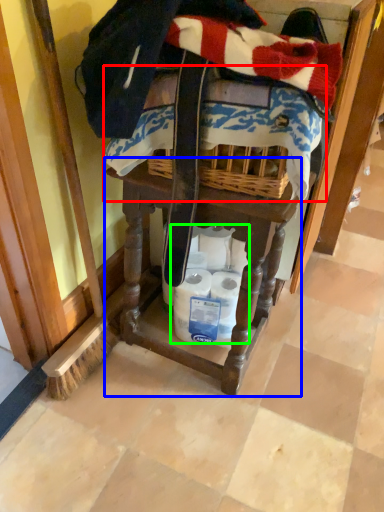
Question: Based on their relative distances, which object is farther from underclothes (highlighted by a red box)? Choose from vanity (highlighted by a blue box) and toilet paper (highlighted by a green box).

Choices:
 (A) vanity
 (B) toilet paper

Answer: (B)